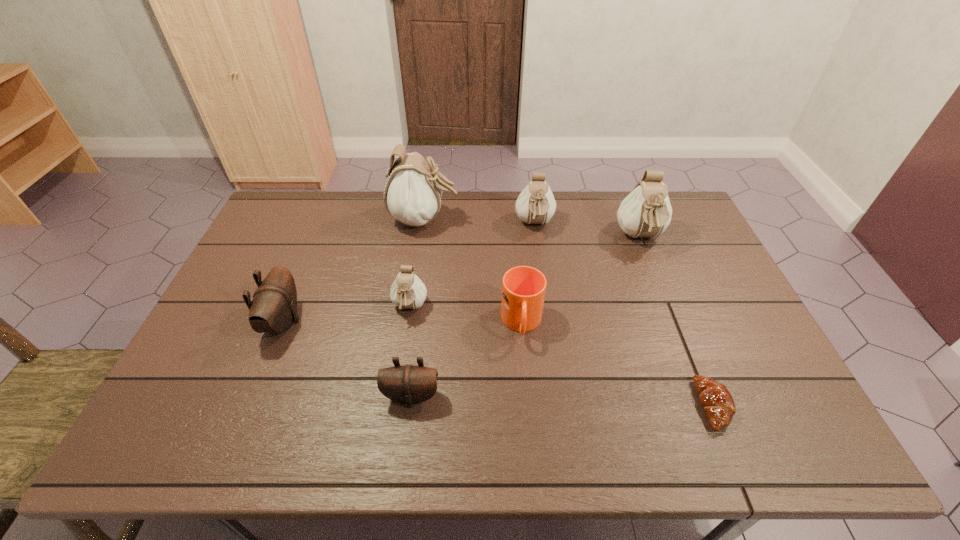
This screenshot has width=960, height=540. What are the coordinates of `the nearer brown pouch` in the screenshot? It's located at (408, 384).

This screenshot has width=960, height=540. What are the coordinates of `the nearest pouch` in the screenshot? It's located at (408, 384).

You are a GUI agent. You are given a task and a screenshot of the screen. Output one action in this format:
    pyautogui.click(x=<x>, y=<y>)
    Task: Click on the brown crescent roll
    The width and height of the screenshot is (960, 540).
    Given the screenshot: What is the action you would take?
    pyautogui.click(x=715, y=398)

Locate an element on the screen. The width and height of the screenshot is (960, 540). the shortest object is located at coordinates (715, 398).

The image size is (960, 540). Identify the location of free space located on the front-facing side of the biggest white pouch. (553, 219).

Locate an element on the screen. vacant area situated on the front-facing side of the rightmost pouch is located at coordinates (657, 280).

Locate an element on the screen. The image size is (960, 540). vacant space situated on the front-facing side of the third biggest white pouch is located at coordinates (539, 252).

Where is `vacant space located with the flap open on the left brown pouch`? The height and width of the screenshot is (540, 960). vacant space located with the flap open on the left brown pouch is located at coordinates (366, 322).

The width and height of the screenshot is (960, 540). I want to click on free region located 0.220m on the handle side of the mug, so click(x=531, y=427).

Where is `free space located on the front-facing side of the nearest white pouch`? This screenshot has width=960, height=540. free space located on the front-facing side of the nearest white pouch is located at coordinates (403, 355).